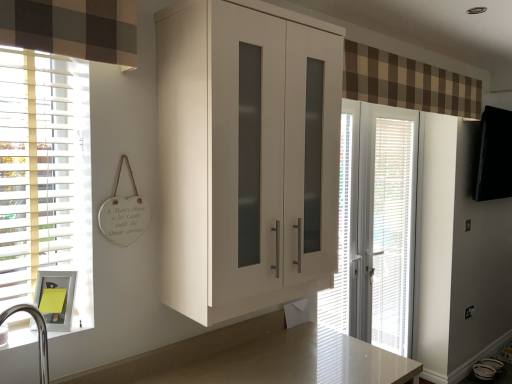
Question: Would you say white textured blind at center, which is the second blind in back-to-front order, is to the left or to the right of brown checkered fabric at upper center in the picture?

Choices:
 (A) right
 (B) left

Answer: (B)

Question: From the image's perspective, relative to brown checkered fabric at upper center, is white textured blind at center, which is the first blind from front to back, above or below?

Choices:
 (A) below
 (B) above

Answer: (A)

Question: Considering the real-world distances, which object is closest to the white plastic blinds at right, which is the second blind from left to right?

Choices:
 (A) brown checkered fabric at upper center
 (B) white glossy cabinet at center
 (C) brushed metal sink at lower left
 (D) white textured blind at center, which is the second blind in back-to-front order
 (E) white glossy door at center

Answer: (E)

Question: Which object is the farthest from the brushed metal sink at lower left?

Choices:
 (A) white plastic blinds at right, acting as the first blind starting from the right
 (B) white glossy medicine cabinet at lower left
 (C) brown checkered fabric at upper center
 (D) white glossy cabinet at center
 (E) white glossy door at center

Answer: (A)